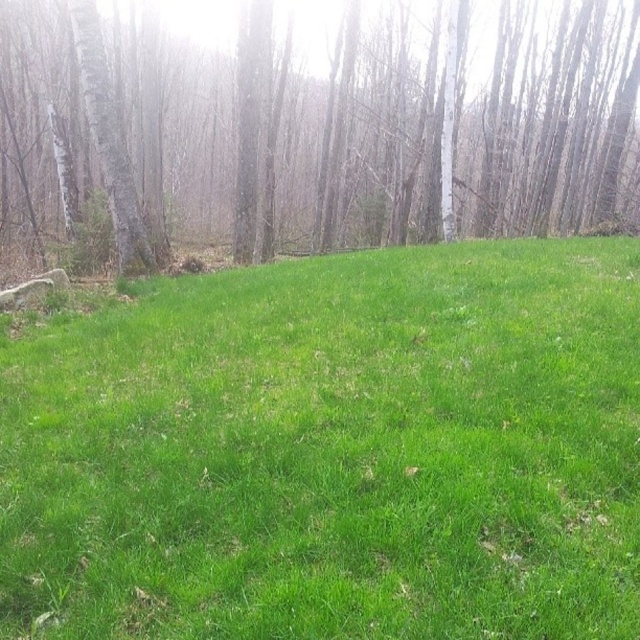
Question: Among these points, which one is farthest from the camera?

Choices:
 (A) (106, 134)
 (B) (545, 289)

Answer: (A)

Question: Can you confirm if bare wood trees at upper center is smaller than smooth bark tree at left?

Choices:
 (A) yes
 (B) no

Answer: (B)

Question: Which object is closer to the camera taking this photo?

Choices:
 (A) green grassy field at center
 (B) bare wood trees at upper center

Answer: (A)

Question: Which point is closer to the camera?

Choices:
 (A) (294, 333)
 (B) (125, 259)
 (C) (586, 26)

Answer: (A)

Question: Can you confirm if bare wood trees at upper center is positioned above smooth bark tree at left?

Choices:
 (A) no
 (B) yes

Answer: (B)

Question: Does green grassy field at center have a greater width compared to bare wood trees at upper center?

Choices:
 (A) no
 (B) yes

Answer: (A)